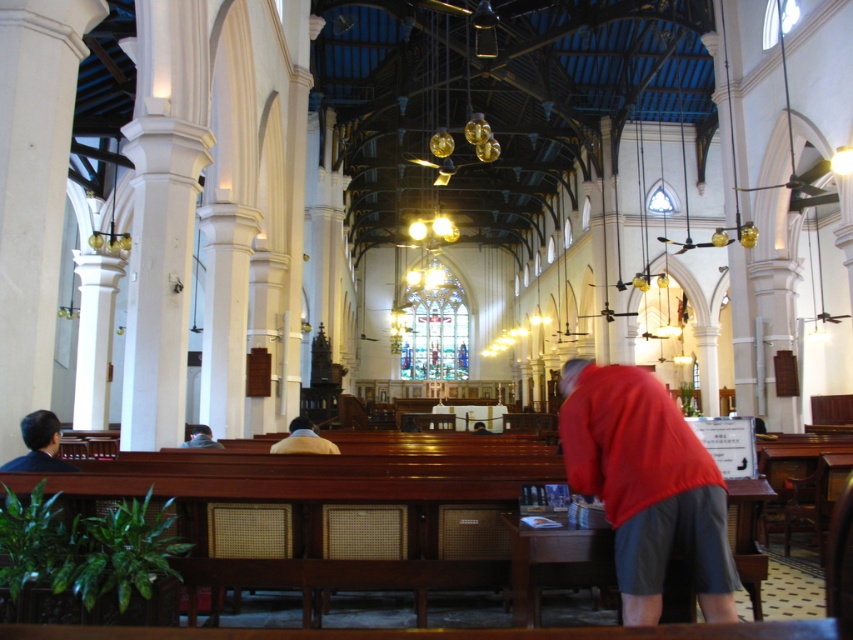
Question: Which object is the closest to the light brown wooden bench at lower left?

Choices:
 (A) matte black hair at left
 (B) yellow fabric jacket at center
 (C) red matte shirt at center

Answer: (B)

Question: Does matte black hair at left have a greater width compared to yellow fabric jacket at center?

Choices:
 (A) yes
 (B) no

Answer: (B)

Question: Which object is the farthest from the light brown wooden bench at lower left?

Choices:
 (A) red matte shirt at center
 (B) matte black hair at left
 (C) yellow fabric jacket at center

Answer: (A)

Question: Where is red matte shirt at center located in relation to yellow fabric jacket at center in the image?

Choices:
 (A) below
 (B) above

Answer: (B)

Question: Which point appears farthest from the camera in this image?

Choices:
 (A) (303, 432)
 (B) (54, 435)
 (C) (196, 436)
 (D) (672, 499)

Answer: (C)

Question: Is red matte shirt at center bigger than yellow fabric jacket at center?

Choices:
 (A) yes
 (B) no

Answer: (A)